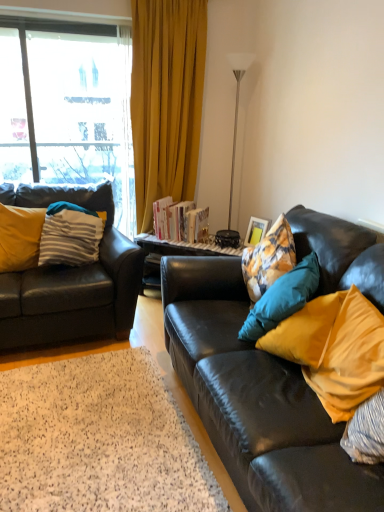
Question: From the image's perspective, would you say striped fabric pillow at left, which is the 4th pillow from front to back, is shown under matte yellow pillow at right, the 2th pillow when ordered from right to left?

Choices:
 (A) no
 (B) yes

Answer: (A)

Question: Does striped fabric pillow at left, placed as the third pillow when sorted from right to left, have a larger size compared to matte yellow pillow at right, the 2th pillow when ordered from right to left?

Choices:
 (A) yes
 (B) no

Answer: (B)

Question: From a real-world perspective, is striped fabric pillow at left, which is the 4th pillow from front to back, on matte yellow pillow at right, marked as the third pillow in a back-to-front arrangement?

Choices:
 (A) yes
 (B) no

Answer: (A)

Question: Is striped fabric pillow at left, marked as the second pillow in a left-to-right arrangement, positioned with its back to matte yellow pillow at right, the 2th pillow in the front-to-back sequence?

Choices:
 (A) yes
 (B) no

Answer: (B)

Question: Is striped fabric pillow at left, which is the first pillow in back-to-front order, shorter than matte yellow pillow at right, which appears as the 3th pillow when viewed from the left?

Choices:
 (A) no
 (B) yes

Answer: (B)

Question: Is striped fabric pillow at left, marked as the second pillow in a left-to-right arrangement, far from matte yellow pillow at right, the 2th pillow when ordered from right to left?

Choices:
 (A) yes
 (B) no

Answer: (A)

Question: Does matte yellow pillow at right, the 2th pillow in the front-to-back sequence, come behind yellow fabric pillow at left, marked as the 3th pillow in a front-to-back arrangement?

Choices:
 (A) yes
 (B) no

Answer: (B)

Question: Is matte yellow pillow at right, marked as the third pillow in a back-to-front arrangement, closer to camera compared to yellow fabric pillow at left, marked as the fourth pillow in a right-to-left arrangement?

Choices:
 (A) no
 (B) yes

Answer: (B)

Question: Could you tell me if matte yellow pillow at right, the 2th pillow when ordered from right to left, is turned towards yellow fabric pillow at left, marked as the fourth pillow in a right-to-left arrangement?

Choices:
 (A) yes
 (B) no

Answer: (A)

Question: Is the surface of matte yellow pillow at right, the 2th pillow when ordered from right to left, in direct contact with yellow fabric pillow at left, which ranks as the 2th pillow in back-to-front order?

Choices:
 (A) no
 (B) yes

Answer: (A)

Question: From the image's perspective, would you say matte yellow pillow at right, marked as the third pillow in a back-to-front arrangement, is positioned over yellow fabric pillow at left, which ranks as the 2th pillow in back-to-front order?

Choices:
 (A) no
 (B) yes

Answer: (A)

Question: Are matte yellow pillow at right, which appears as the 3th pillow when viewed from the left, and yellow fabric pillow at left, marked as the fourth pillow in a right-to-left arrangement, located far from each other?

Choices:
 (A) no
 (B) yes

Answer: (B)

Question: Is white shag rug at lower left positioned behind matte yellow pillow at right, which ranks as the 4th pillow in back-to-front order?

Choices:
 (A) yes
 (B) no

Answer: (A)